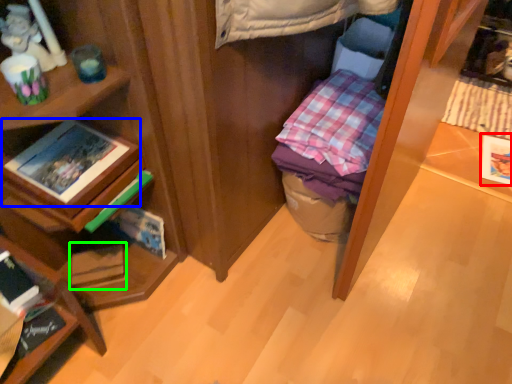
Question: Based on their relative distances, which object is nearer to paperback book (highlighted by a red box)? Choose from book (highlighted by a blue box) and paperback book (highlighted by a green box).

Choices:
 (A) book
 (B) paperback book

Answer: (B)